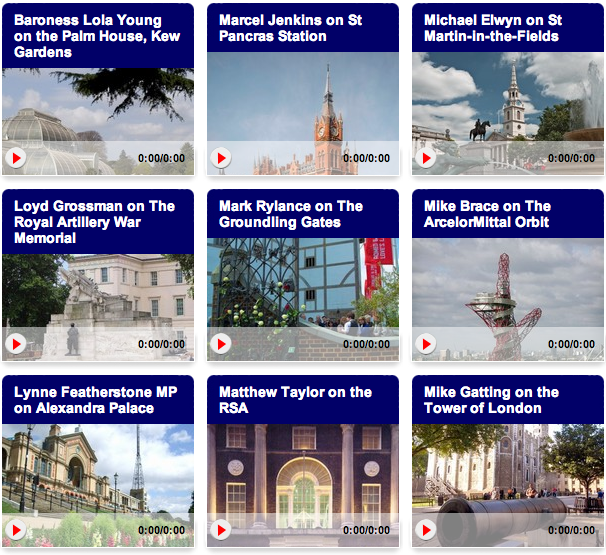
At what (x,y) coordinates should I click in order to perform the action: click on windows. Please return your answer as a coordinate pair (x, y). This screenshot has width=606, height=555. Looking at the image, I should click on (152, 280), (311, 296), (517, 115), (21, 128), (305, 440), (42, 463), (505, 442).